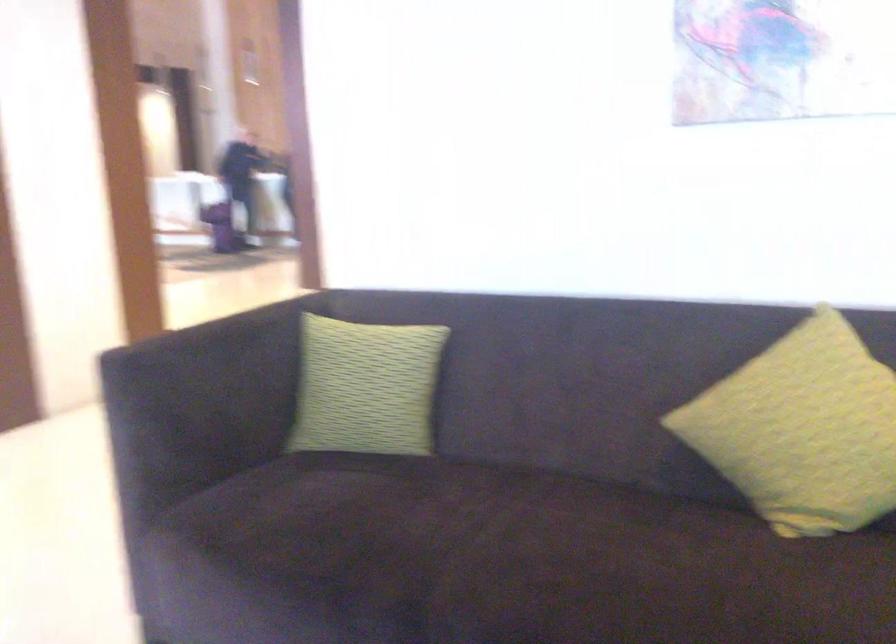
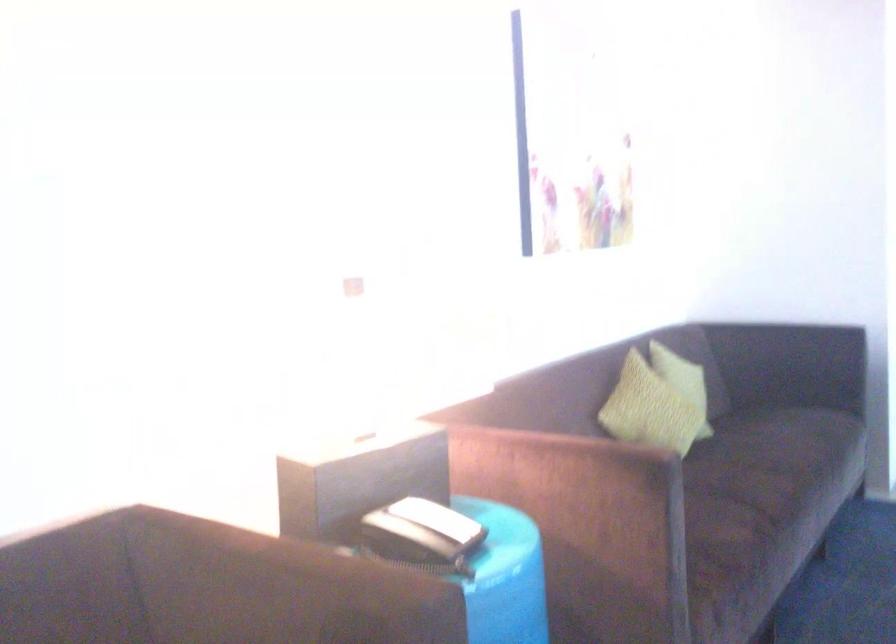
Question: The first image is from the beginning of the video and the second image is from the end. How did the camera likely rotate when shooting the video?

Choices:
 (A) Left
 (B) Right
 (C) Up
 (D) Down

Answer: (B)